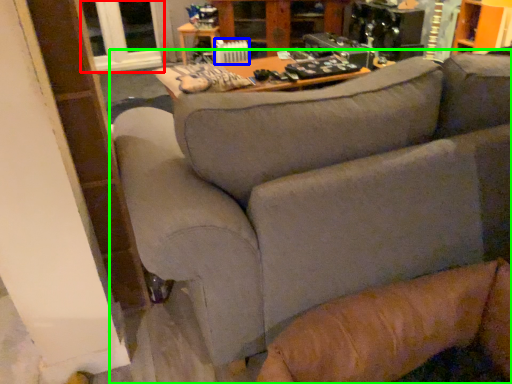
Question: Which object is positioned farthest from window (highlighted by a red box)? Select from radiator (highlighted by a blue box) and studio couch (highlighted by a green box).

Choices:
 (A) radiator
 (B) studio couch

Answer: (B)